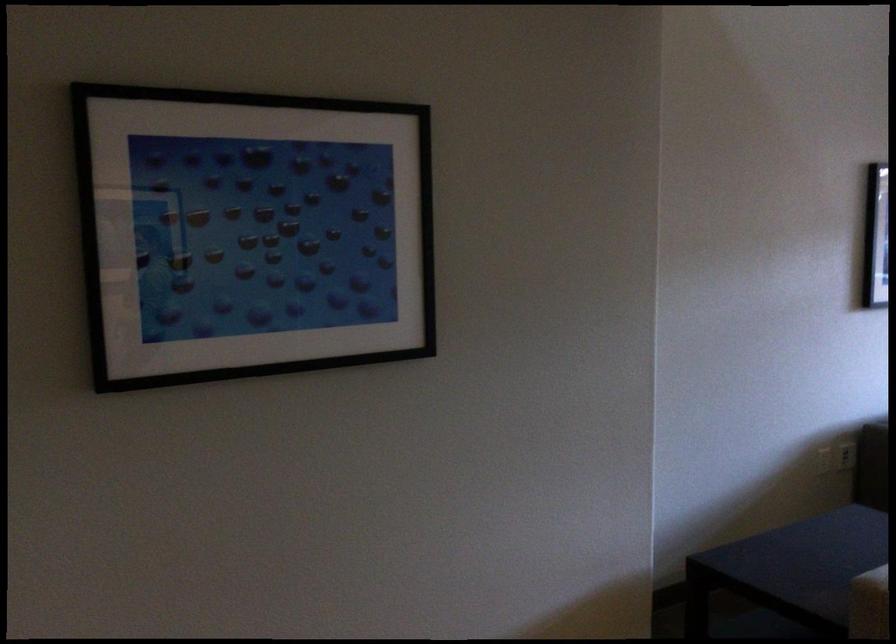
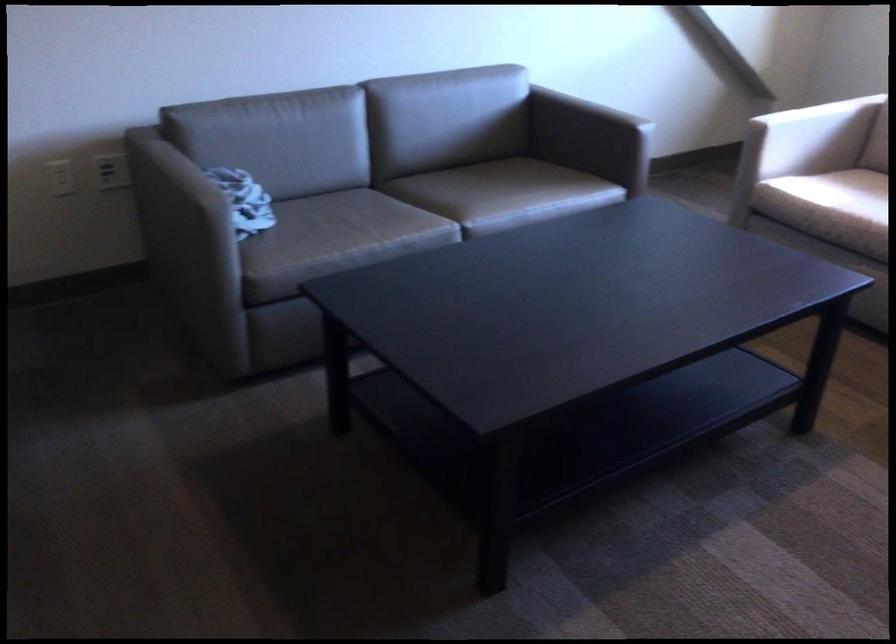
Question: Which direction would the cameraman need to move to produce the second image? Reply with the corresponding letter.

Choices:
 (A) Left
 (B) Right
 (C) Forward
 (D) Backward

Answer: (B)